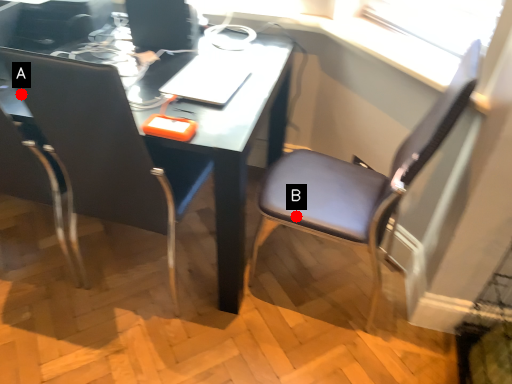
Question: Two points are circled on the image, labeled by A and B beside each circle. Which of the following is the farthest from the observer?

Choices:
 (A) A is further
 (B) B is further

Answer: (B)